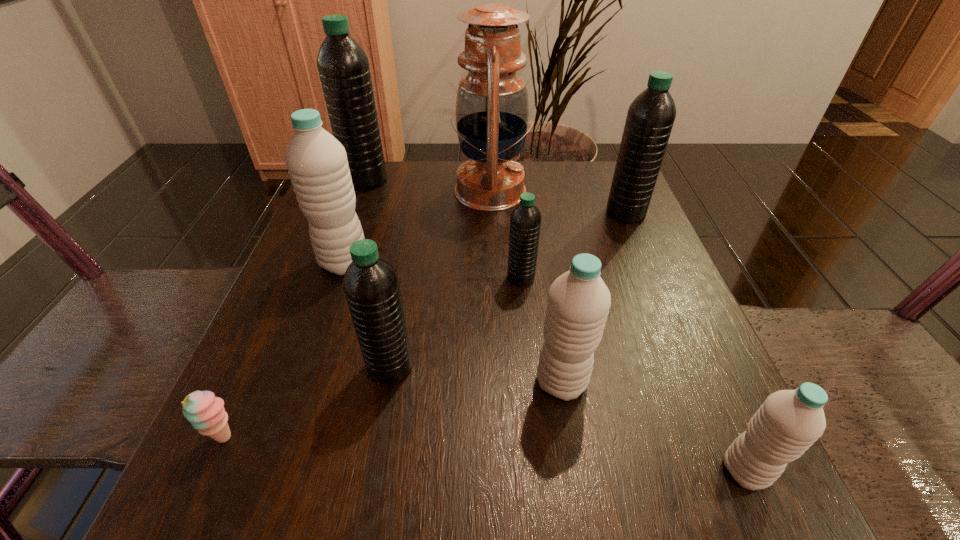
The height and width of the screenshot is (540, 960). Identify the location of free space between the second smallest black water bottle and the second biggest black water bottle. (508, 290).

The height and width of the screenshot is (540, 960). In order to click on vacant point located between the third smallest black water bottle and the nearest water bottle in this screenshot , I will do `click(685, 342)`.

You are a GUI agent. You are given a task and a screenshot of the screen. Output one action in this format:
    pyautogui.click(x=<x>, y=<y>)
    Task: Click on the empty location between the second black water bottle from right to left and the farthest white water bottle
    
    Given the screenshot: What is the action you would take?
    [433, 270]

I want to click on empty space that is in between the tallest water bottle and the second nearest white water bottle, so click(x=464, y=281).

Locate which object is the seventh closest to the second black water bottle from left to right. Please provide its 2D coordinates. Your answer should be formatted as a tuple, i.e. [(x, y)], where the tuple contains the x and y coordinates of a point satisfying the conditions above.

[(343, 66)]

The width and height of the screenshot is (960, 540). In order to click on object that is the fourth closest to the smallest black water bottle in this screenshot , I will do `click(650, 117)`.

Image resolution: width=960 pixels, height=540 pixels. I want to click on water bottle object that ranks as the third closest to the second nearest white water bottle, so click(371, 286).

In order to click on water bottle that can be found as the fourth closest to the second farthest white water bottle in this screenshot , I will do `click(317, 164)`.

Where is `black water bottle identified as the third closest to the leftmost white water bottle`? The height and width of the screenshot is (540, 960). black water bottle identified as the third closest to the leftmost white water bottle is located at coordinates (525, 221).

This screenshot has width=960, height=540. Find the location of `the closest black water bottle to the leftmost black water bottle`. the closest black water bottle to the leftmost black water bottle is located at coordinates (525, 221).